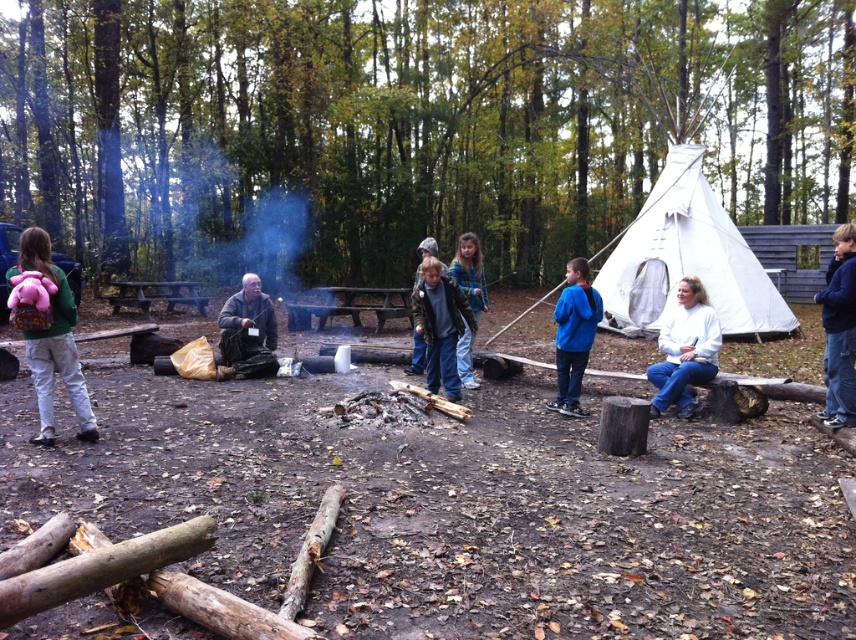
Question: Which point is farther to the camera?

Choices:
 (A) dark brown leather jacket at center
 (B) pink fabric backpack at left
 (C) blue fleece jacket at right

Answer: (A)

Question: Is pink fabric backpack at left bigger than blue denim jeans at center?

Choices:
 (A) no
 (B) yes

Answer: (A)

Question: Can you confirm if pink fabric backpack at left is smaller than blue denim jeans at center?

Choices:
 (A) yes
 (B) no

Answer: (A)

Question: Which is nearer to the blue fleece jacket at center?

Choices:
 (A) dark blue jeans at center
 (B) pink fabric backpack at left

Answer: (A)

Question: Is blue fleece jacket at right below brown leather jacket at center?

Choices:
 (A) no
 (B) yes

Answer: (A)

Question: Which of the following is the farthest from the observer?

Choices:
 (A) brown leather jacket at center
 (B) pink fabric backpack at left

Answer: (A)